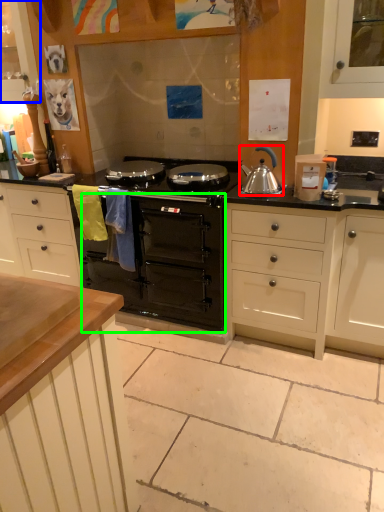
Question: Considering the real-world distances, which object is closest to kitchen appliance (highlighted by a red box)? cabinetry (highlighted by a blue box) or oven (highlighted by a green box).

Choices:
 (A) cabinetry
 (B) oven

Answer: (B)